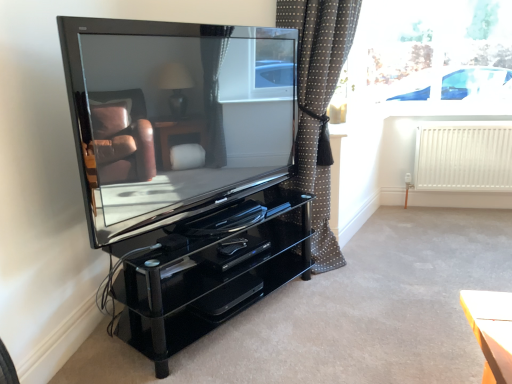
Question: Is black glossy dvd player at center directly adjacent to white matte radiator at right?

Choices:
 (A) yes
 (B) no

Answer: (B)

Question: Does black glossy dvd player at center have a lesser width compared to white matte radiator at right?

Choices:
 (A) no
 (B) yes

Answer: (A)

Question: Does black glossy dvd player at center lie in front of white matte radiator at right?

Choices:
 (A) yes
 (B) no

Answer: (A)

Question: Does black glossy dvd player at center have a lesser height compared to white matte radiator at right?

Choices:
 (A) no
 (B) yes

Answer: (B)

Question: Is black glossy dvd player at center positioned far away from white matte radiator at right?

Choices:
 (A) yes
 (B) no

Answer: (A)

Question: In terms of height, does glossy black television at center look taller or shorter compared to black glossy dvd player at center?

Choices:
 (A) tall
 (B) short

Answer: (A)

Question: Does point (110, 196) appear closer or farther from the camera than point (248, 251)?

Choices:
 (A) closer
 (B) farther

Answer: (A)

Question: From the image's perspective, is glossy black television at center positioned above or below black glossy dvd player at center?

Choices:
 (A) below
 (B) above

Answer: (B)

Question: Is glossy black television at center inside or outside of black glossy dvd player at center?

Choices:
 (A) inside
 (B) outside

Answer: (B)

Question: Considering the relative positions of polka dot fabric curtain at center and white matte radiator at right in the image provided, is polka dot fabric curtain at center to the left or to the right of white matte radiator at right?

Choices:
 (A) right
 (B) left

Answer: (B)

Question: Based on their sizes in the image, would you say polka dot fabric curtain at center is bigger or smaller than white matte radiator at right?

Choices:
 (A) small
 (B) big

Answer: (B)

Question: Is polka dot fabric curtain at center taller or shorter than white matte radiator at right?

Choices:
 (A) short
 (B) tall

Answer: (B)

Question: From a real-world perspective, relative to white matte radiator at right, is polka dot fabric curtain at center vertically above or below?

Choices:
 (A) below
 (B) above

Answer: (B)

Question: From their relative heights in the image, would you say glossy black television at center is taller or shorter than polka dot fabric curtain at center?

Choices:
 (A) short
 (B) tall

Answer: (A)

Question: In terms of width, does glossy black television at center look wider or thinner when compared to polka dot fabric curtain at center?

Choices:
 (A) wide
 (B) thin

Answer: (B)